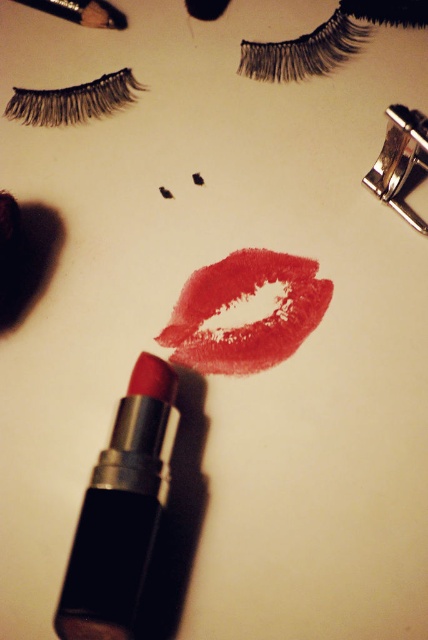
Can you confirm if matte black lipstick at lower left is taller than black synthetic false eyelashes at upper left?

Indeed, matte black lipstick at lower left has a greater height compared to black synthetic false eyelashes at upper left.

Who is shorter, matte black lipstick at lower left or black synthetic false eyelashes at upper left?

black synthetic false eyelashes at upper left

Based on the photo, who is more forward, (130, 520) or (95, 81)?

Positioned in front is point (130, 520).

Where is `matte black lipstick at lower left`? This screenshot has height=640, width=428. matte black lipstick at lower left is located at coordinates (118, 513).

Is shiny red lipstick at center to the left of metallic silver brush at upper left from the viewer's perspective?

Incorrect, shiny red lipstick at center is not on the left side of metallic silver brush at upper left.

Is shiny red lipstick at center in front of metallic silver brush at upper left?

That is True.

Where is `shiny red lipstick at center`? This screenshot has width=428, height=640. shiny red lipstick at center is located at coordinates (246, 320).

Image resolution: width=428 pixels, height=640 pixels. I want to click on shiny red lipstick at center, so click(x=246, y=320).

Does matte black lipstick at lower left appear under shiny red lipstick at center?

Indeed, matte black lipstick at lower left is positioned under shiny red lipstick at center.

Does matte black lipstick at lower left have a greater height compared to shiny red lipstick at center?

Yes, matte black lipstick at lower left is taller than shiny red lipstick at center.

At what (x,y) coordinates should I click in order to perform the action: click on matte black lipstick at lower left. Please return your answer as a coordinate pair (x, y). Looking at the image, I should click on pyautogui.click(x=118, y=513).